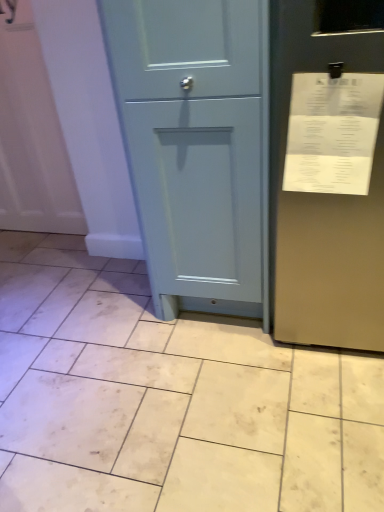
The width and height of the screenshot is (384, 512). What are the coordinates of `vacant space situated above white glossy tile at lower left, acting as the second ceramic tile starting from the bottom (from a real-world perspective)` in the screenshot? It's located at (28, 239).